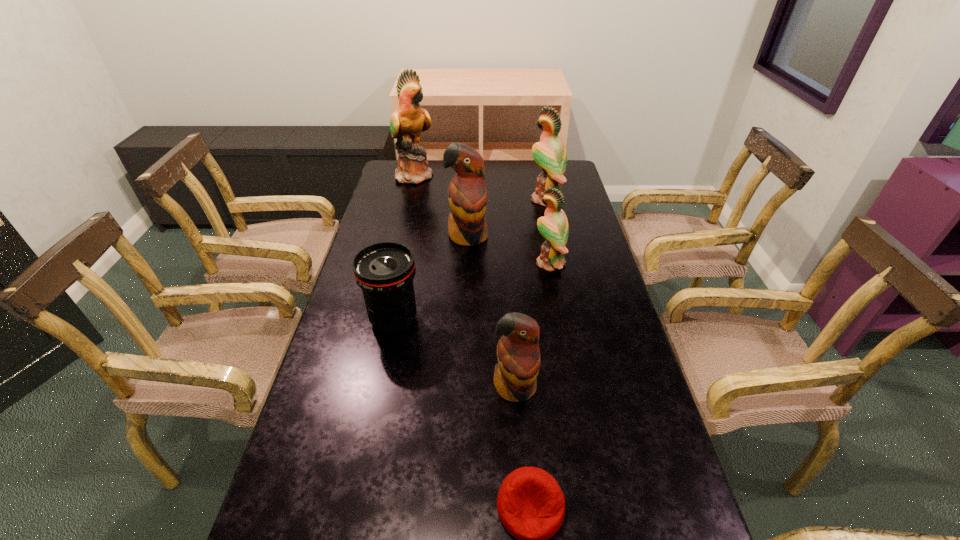
Where is `telephoto lens`? telephoto lens is located at coordinates (384, 271).

Identify the location of the second shortest object. The width and height of the screenshot is (960, 540). (384, 271).

Where is `vacant region located 0.180m on the front-facing side of the tallest parrot`? vacant region located 0.180m on the front-facing side of the tallest parrot is located at coordinates (477, 176).

Where is `free location located 0.360m on the front-facing side of the second biggest green parrot`? This screenshot has height=540, width=960. free location located 0.360m on the front-facing side of the second biggest green parrot is located at coordinates (439, 199).

You are a GUI agent. You are given a task and a screenshot of the screen. Output one action in this format:
    pyautogui.click(x=<x>, y=<y>)
    Task: Click on the vacant space located on the front-facing side of the second biggest green parrot
    
    Given the screenshot: What is the action you would take?
    pyautogui.click(x=481, y=199)

Find the location of a particular element. vacant space located 0.220m on the front-facing side of the second biggest green parrot is located at coordinates (473, 199).

Where is `vacant space located 0.200m on the face of the third nearest parrot`? This screenshot has width=960, height=540. vacant space located 0.200m on the face of the third nearest parrot is located at coordinates (466, 291).

At what (x,y) coordinates should I click in order to perform the action: click on vacant space located 0.220m on the front-facing side of the smallest green parrot. Please return your answer as a coordinate pair (x, y). This screenshot has height=540, width=960. Looking at the image, I should click on (468, 263).

Where is `vacant space located 0.280m on the front-facing side of the smallest green parrot`? The height and width of the screenshot is (540, 960). vacant space located 0.280m on the front-facing side of the smallest green parrot is located at coordinates (449, 263).

What are the coordinates of `blank space located 0.290m on the front-facing side of the smallest green parrot` in the screenshot? It's located at (446, 263).